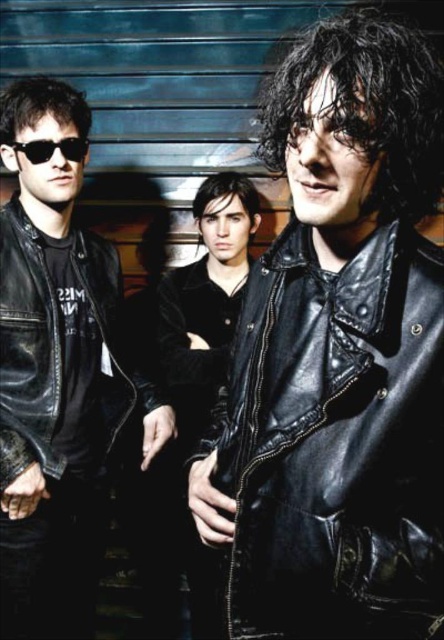
Question: Is shiny black leather jacket at center above matte black leather jacket at left?

Choices:
 (A) yes
 (B) no

Answer: (B)

Question: Does matte black leather jacket at left lie behind black matte sunglasses at left?

Choices:
 (A) yes
 (B) no

Answer: (B)

Question: Which point is closer to the camera?

Choices:
 (A) matte black leather jacket at left
 (B) black matte sunglasses at left
 (C) shiny black leather jacket at center

Answer: (C)

Question: Among these points, which one is farthest from the camera?

Choices:
 (A) 60,147
 (B) 8,477
 (C) 440,552

Answer: (A)

Question: Can you confirm if matte black leather jacket at left is wider than black matte sunglasses at left?

Choices:
 (A) no
 (B) yes

Answer: (B)

Question: Which point is closer to the camera?

Choices:
 (A) matte black leather jacket at left
 (B) black matte sunglasses at left

Answer: (A)